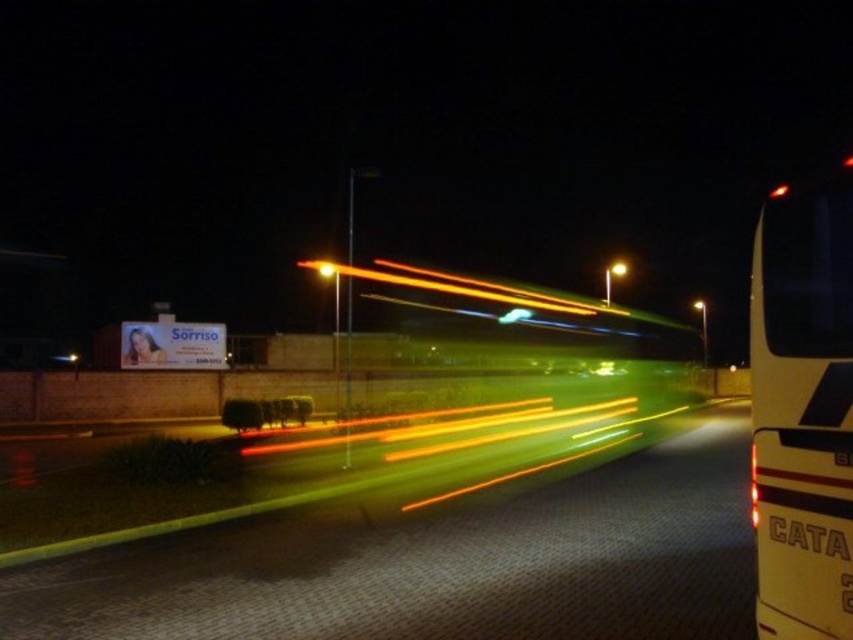
Who is positioned more to the right, yellow light trails at center or white matte/decorative bus at right?

white matte/decorative bus at right

Is yellow light trails at center smaller than white matte/decorative bus at right?

Indeed, yellow light trails at center has a smaller size compared to white matte/decorative bus at right.

The height and width of the screenshot is (640, 853). Describe the element at coordinates (436, 563) in the screenshot. I see `yellow light trails at center` at that location.

Locate an element on the screen. This screenshot has width=853, height=640. yellow light trails at center is located at coordinates (436, 563).